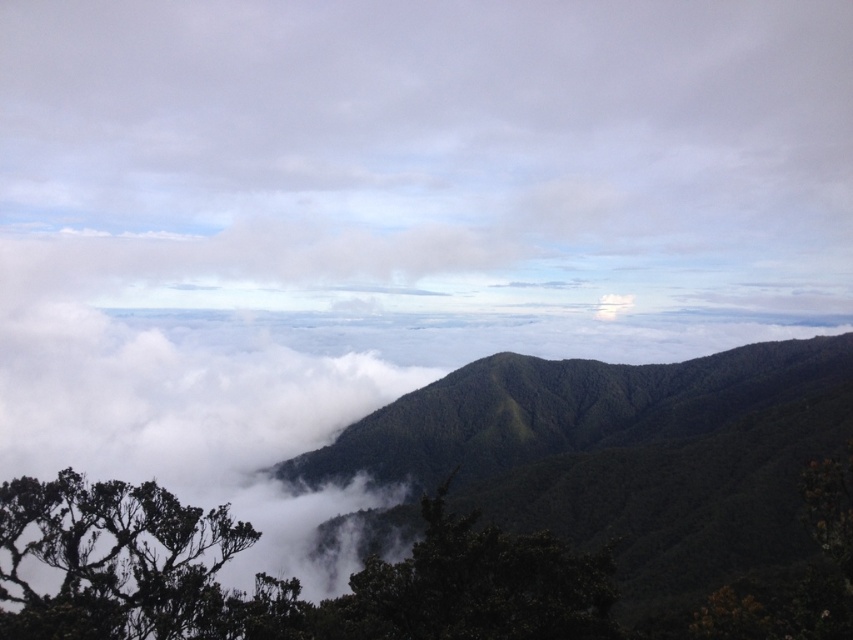
Who is higher up, dark green leafy tree at lower left or green leafy tree at center?

Positioned higher is dark green leafy tree at lower left.

Between point (170, 500) and point (440, 614), which one is positioned behind?

Positioned behind is point (170, 500).

Identify the location of dark green leafy tree at lower left. The height and width of the screenshot is (640, 853). (115, 561).

Image resolution: width=853 pixels, height=640 pixels. What do you see at coordinates (610, 456) in the screenshot?
I see `green textured mountain at center` at bounding box center [610, 456].

Where is `green textured mountain at center`? This screenshot has width=853, height=640. green textured mountain at center is located at coordinates (610, 456).

Between point (569, 385) and point (511, 628), which one is positioned behind?

The point (569, 385) is more distant.

Identify the location of green textured mountain at center. The height and width of the screenshot is (640, 853). (610, 456).

Between point (482, 476) and point (102, 611), which one is positioned in front?

Point (102, 611) is more forward.

Looking at this image, can you confirm if green textured mountain at center is shorter than dark green leafy tree at lower left?

No.

Is point (508, 499) positioned before point (183, 556)?

No, (508, 499) is behind (183, 556).

This screenshot has width=853, height=640. I want to click on green textured mountain at center, so click(610, 456).